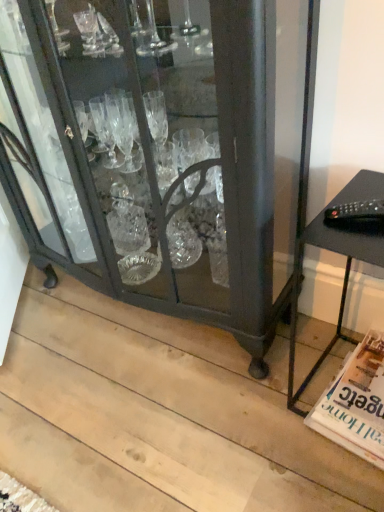
Where is `vacant area to the left of black matte table at right`? vacant area to the left of black matte table at right is located at coordinates (256, 410).